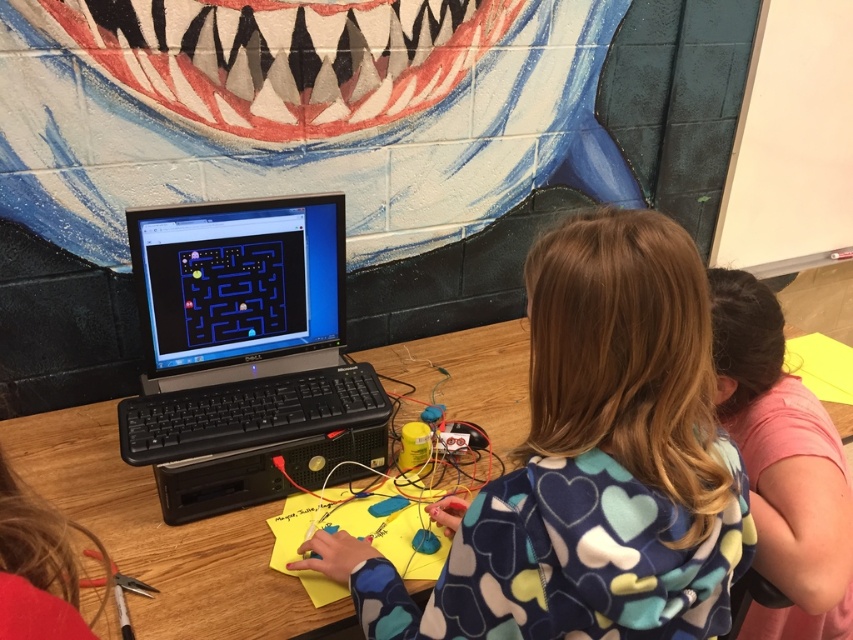
You are a robot standing 1.5 meters away from the camera. You need to move closer to the point at coordinates point (274, 301). Can you reach it without moving past the point?

The point (274, 301) is 1.35 meters away from the camera. Since you are currently 1.5 meters away, moving closer would bring you to 1.35 meters, which is exactly at the point. Therefore, you can reach it without moving past.